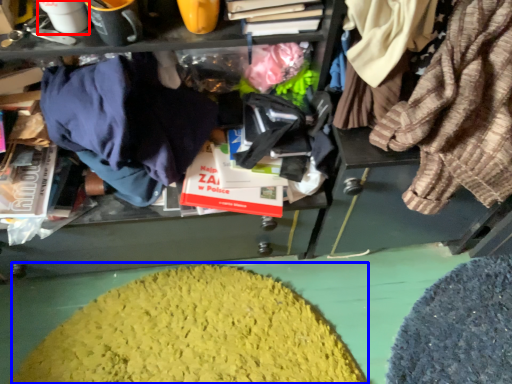
Question: Which point is closer to the camera, coffee cup (highlighted by a red box) or debris (highlighted by a blue box)?

Choices:
 (A) coffee cup
 (B) debris

Answer: (A)